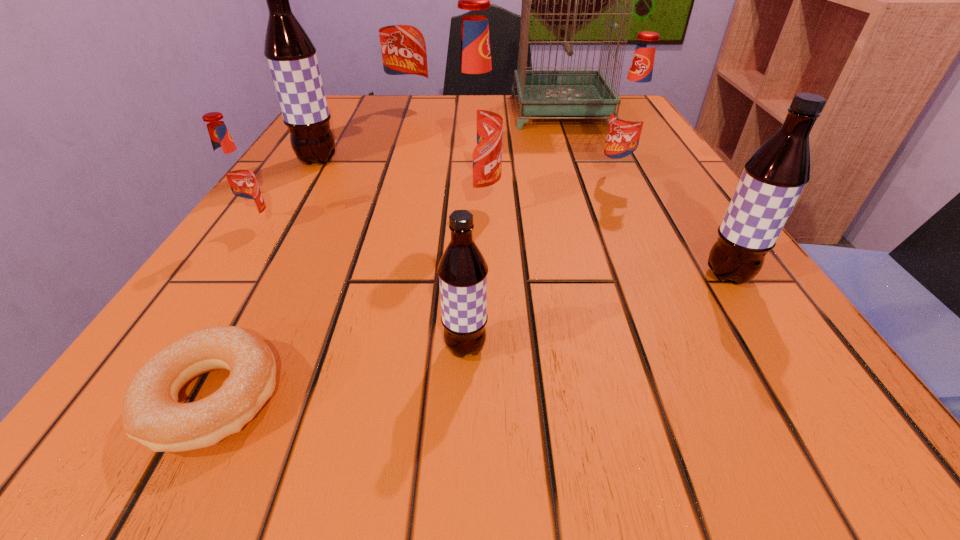
At what (x,y) coordinates should I click in order to perform the action: click on free space located 0.380m on the right of the biggest brown root beer. Please return your answer as a coordinate pair (x, y). Looking at the image, I should click on (535, 160).

Locate an element on the screen. vacant space situated on the front of the third smallest red root beer is located at coordinates (474, 299).

This screenshot has width=960, height=540. Find the location of `vacant space located 0.350m on the front of the second smallest red root beer`. vacant space located 0.350m on the front of the second smallest red root beer is located at coordinates (693, 335).

Find the location of a particular element. The height and width of the screenshot is (540, 960). blank space located 0.060m on the left of the third nearest object is located at coordinates (659, 275).

You are a GUI agent. You are given a task and a screenshot of the screen. Output one action in this format:
    pyautogui.click(x=<x>, y=<y>)
    Task: Click on the vacant space located 0.300m on the back of the leftmost red root beer
    Image resolution: width=960 pixels, height=540 pixels.
    Given the screenshot: What is the action you would take?
    pyautogui.click(x=315, y=140)

You are a GUI agent. You are given a task and a screenshot of the screen. Output one action in this format:
    pyautogui.click(x=<x>, y=<y>)
    Task: Click on the free space located on the back of the second brown root beer from right to left
    The image size is (960, 540).
    Given the screenshot: What is the action you would take?
    pyautogui.click(x=470, y=202)

I want to click on vacant space situated on the back of the shortest object, so click(303, 227).

At what (x,y) coordinates should I click in order to perform the action: click on birdcage positioned at the far edge. Please return your answer as a coordinate pair (x, y). Image resolution: width=960 pixels, height=540 pixels. Looking at the image, I should click on (539, 95).

Where is `root beer that is positioned at the far edge`? The image size is (960, 540). root beer that is positioned at the far edge is located at coordinates (401, 27).

Locate an element on the screen. object that is at the near edge is located at coordinates (152, 415).